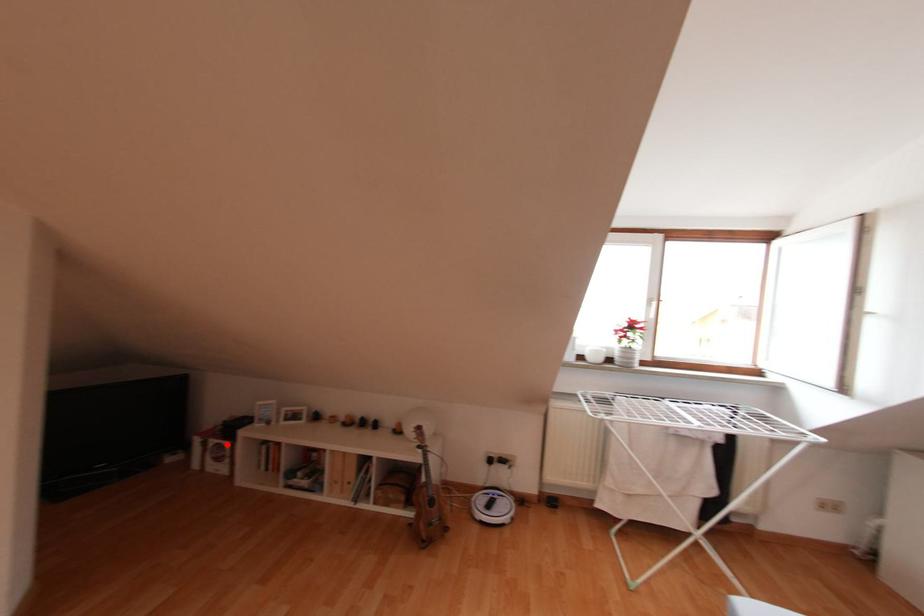
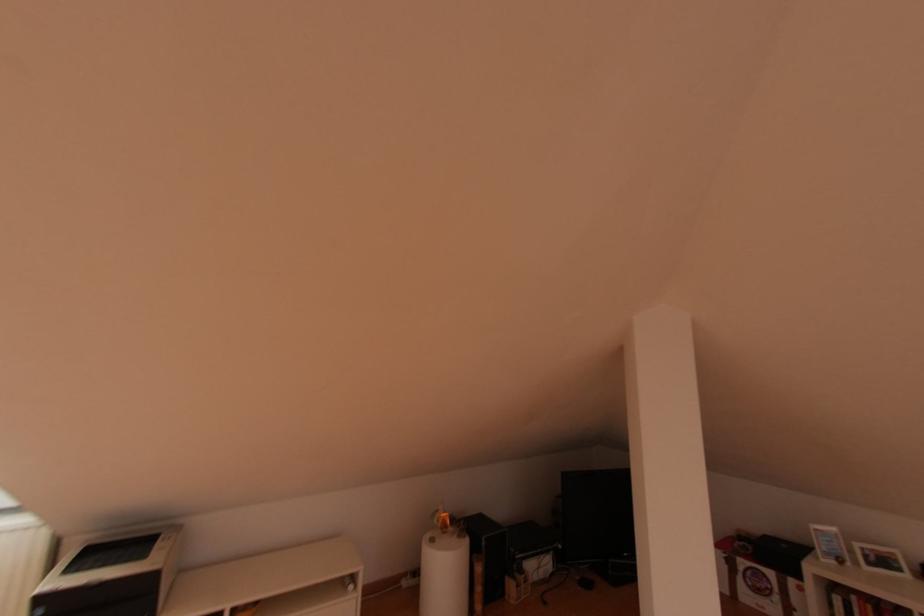
In the second image, find the point that corresponds to the highlighted location in the first image.

(771, 573)